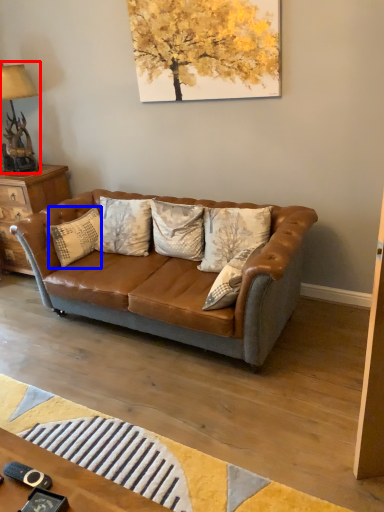
Question: Which object is further to the camera taking this photo, lamp (highlighted by a red box) or pillow (highlighted by a blue box)?

Choices:
 (A) lamp
 (B) pillow

Answer: (A)